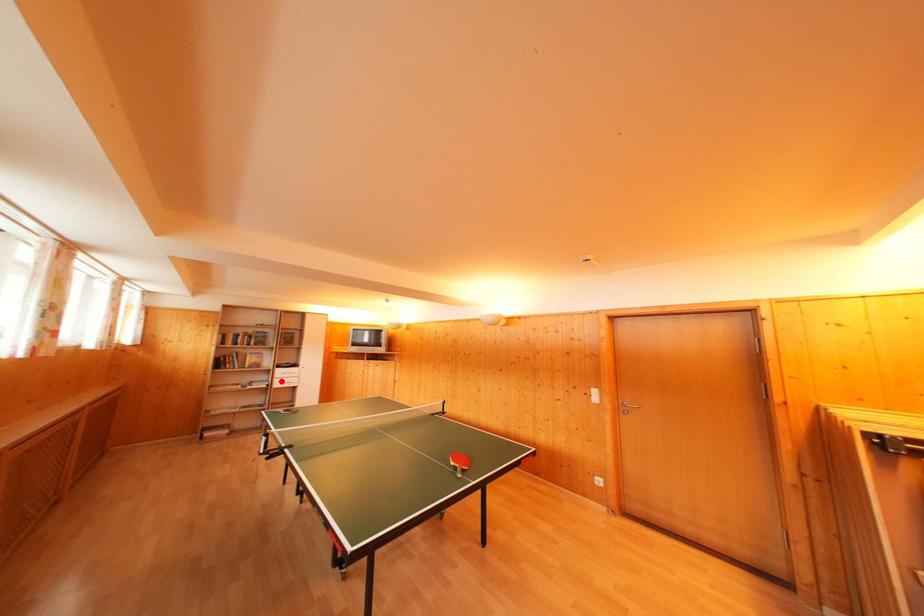
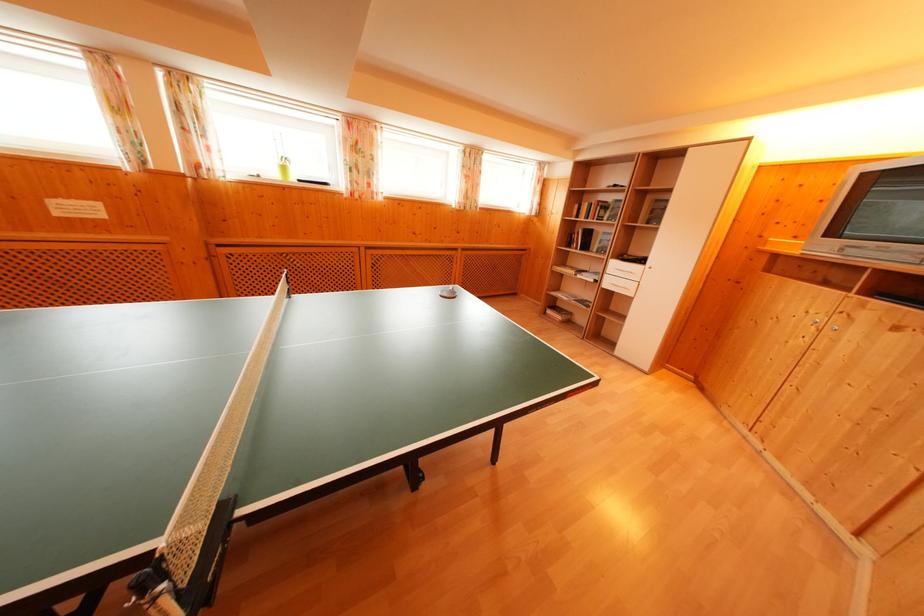
In the second image, find the point that corresponds to the highlighted location in the first image.

(614, 276)